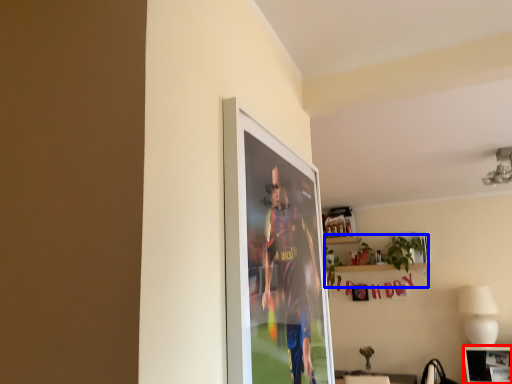
Question: Which point is closer to the camera, picture frame (highlighted by a red box) or houseplant (highlighted by a blue box)?

Choices:
 (A) picture frame
 (B) houseplant

Answer: (A)